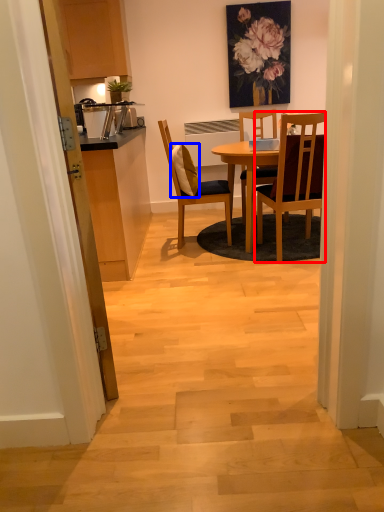
Question: Which object appears farthest to the camera in this image, chair (highlighted by a red box) or pillow (highlighted by a blue box)?

Choices:
 (A) chair
 (B) pillow

Answer: (B)